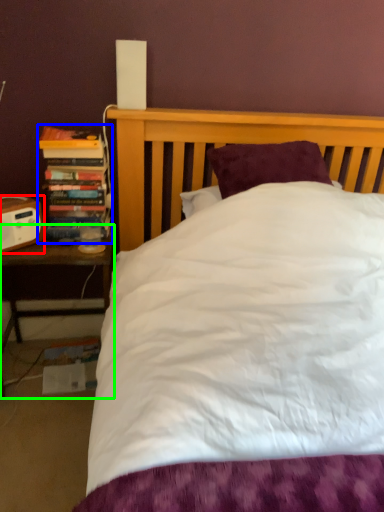
Question: Estimate the real-world distances between objects in this image. Which object is closer to speaker (highlighted by a red box), book (highlighted by a blue box) or nightstand (highlighted by a green box)?

Choices:
 (A) book
 (B) nightstand

Answer: (A)